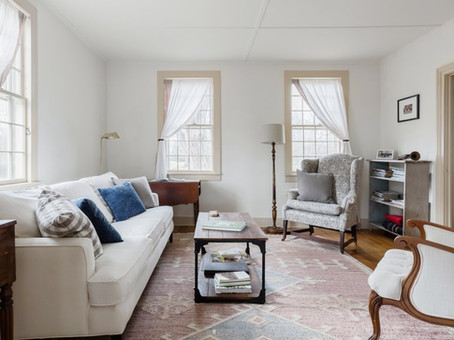
Where is `windows`? The image size is (454, 340). windows is located at coordinates (14, 105), (190, 129), (314, 129).